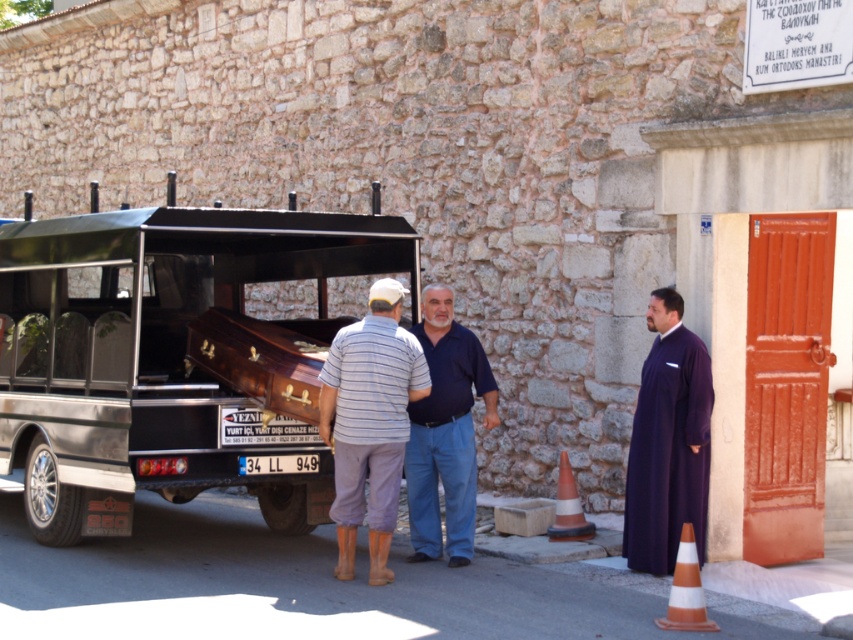
Question: Can you confirm if purple matte robe at center is wider than orange/white striped cone at lower right?

Choices:
 (A) yes
 (B) no

Answer: (A)

Question: Observing the image, what is the correct spatial positioning of striped cotton shirt at center in reference to white plastic license plate at center?

Choices:
 (A) below
 (B) above

Answer: (B)

Question: Estimate the real-world distances between objects in this image. Which object is farther from the white plastic license plate at center?

Choices:
 (A) orange/white striped cone at lower right
 (B) wooden polished casket at center

Answer: (A)

Question: Can you confirm if purple matte robe at right is thinner than dark blue shirt at center?

Choices:
 (A) no
 (B) yes

Answer: (B)

Question: Which is nearer to the striped cotton shirt at center?

Choices:
 (A) purple matte robe at right
 (B) dark blue shirt at center
 (C) orange/white striped cone at lower right
 (D) white plastic license plate at center

Answer: (B)

Question: Estimate the real-world distances between objects in this image. Which object is closer to the wooden polished casket at center?

Choices:
 (A) white plastic license plate at center
 (B) orange/white striped cone at lower right
 (C) striped cotton shirt at center

Answer: (A)